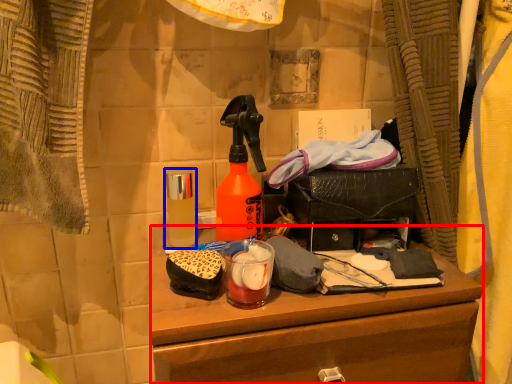
Question: Which object is further to the camera taking this photo, desk (highlighted by a red box) or bottle (highlighted by a blue box)?

Choices:
 (A) desk
 (B) bottle

Answer: (B)